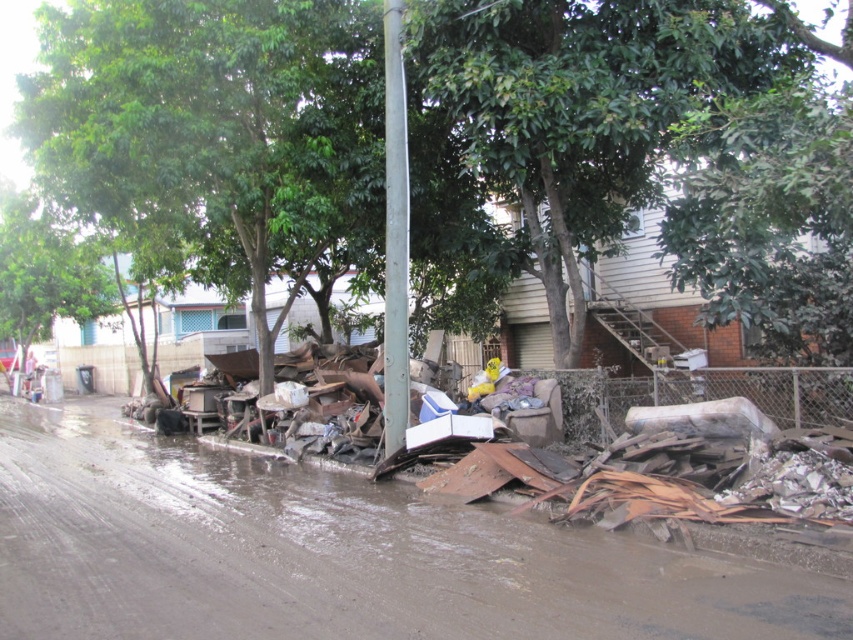
Question: Does rusty metal debris at lower right appear on the right side of metallic gray pole at center?

Choices:
 (A) yes
 (B) no

Answer: (B)

Question: Which point is closer to the camera?

Choices:
 (A) (263, 353)
 (B) (399, 321)
 (C) (35, 435)

Answer: (B)

Question: Which object is positioned farthest from the metallic gray pole at center?

Choices:
 (A) green leafy tree at center
 (B) rusty metal debris at lower right

Answer: (A)

Question: Can you confirm if rusty metal debris at lower right is positioned to the right of green leafy tree at center?

Choices:
 (A) no
 (B) yes

Answer: (A)

Question: Estimate the real-world distances between objects in this image. Which object is farther from the metallic gray pole at center?

Choices:
 (A) green leafy tree at center
 (B) rusty metal debris at lower right

Answer: (A)

Question: Does rusty metal debris at lower right appear on the left side of metallic gray pole at center?

Choices:
 (A) yes
 (B) no

Answer: (A)